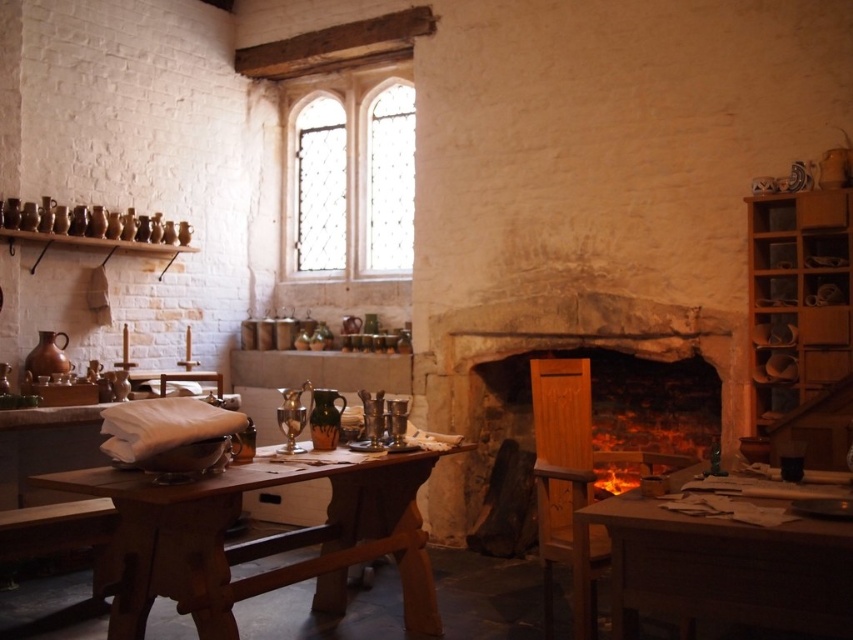
You are a medieval servant carrying a large tray of dishes. You need to place them either on the wooden table at lower right or the wooden shelves at right. If the tray is 3 feet wide, which surface can accommodate it without overhanging?

The wooden table at lower right and wooden shelves at right are 6.34 feet apart. Since the tray is 3 feet wide, both surfaces can accommodate it as their width is likely larger than 3 feet. However, the exact width of the surfaces isn not provided, so we can only confirm the distance between them.

You are a medieval servant needing to deliver a message to the lord in the next room. You are currently standing at the wooden table at lower right. The door to the next room is near the clear glass window at upper center. Can you walk straight to the door without any obstacles?

The wooden table at lower right is 4.19 meters from the clear glass window at upper center. Since the distance is over 4 meters, it is likely that there are no obstacles in between, so you can walk straight to the door near the clear glass window at upper center.